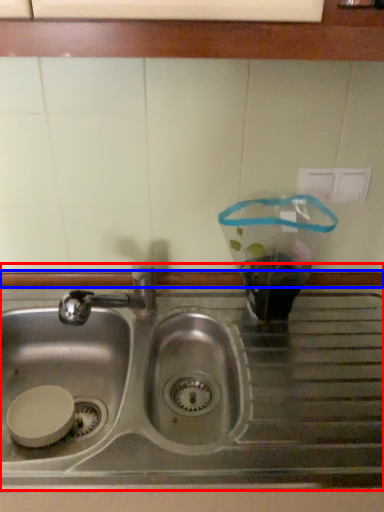
Question: Which object is closer to the camera taking this photo, sink (highlighted by a red box) or window sill (highlighted by a blue box)?

Choices:
 (A) sink
 (B) window sill

Answer: (A)